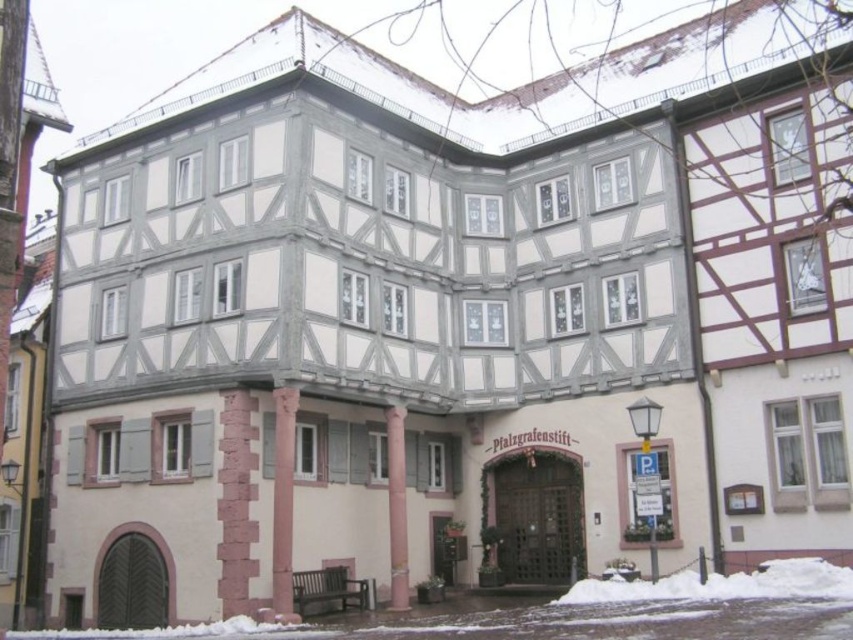
Does white powdery snow at lower left have a larger size compared to pink painted wood column at center?

Yes.

Does white powdery snow at lower left have a greater width compared to pink painted wood column at center?

Indeed, white powdery snow at lower left has a greater width compared to pink painted wood column at center.

Between point (412, 618) and point (404, 492), which one is positioned in front?

Point (412, 618)

The image size is (853, 640). Find the location of `white powdery snow at lower left`. white powdery snow at lower left is located at coordinates (596, 612).

Is white powdery snow at lower left thinner than white powdery snow at lower center?

No, white powdery snow at lower left is not thinner than white powdery snow at lower center.

How far apart are white powdery snow at lower left and white powdery snow at lower center?

A distance of 4.89 meters exists between white powdery snow at lower left and white powdery snow at lower center.

Describe the element at coordinates (596, 612) in the screenshot. I see `white powdery snow at lower left` at that location.

At what (x,y) coordinates should I click in order to perform the action: click on white powdery snow at lower left. Please return your answer as a coordinate pair (x, y). Looking at the image, I should click on 596,612.

Is white powdery snow at lower center positioned at the back of pink stone pillar at lower left?

No, it is in front of pink stone pillar at lower left.

Can you confirm if white powdery snow at lower center is smaller than pink stone pillar at lower left?

Actually, white powdery snow at lower center might be larger than pink stone pillar at lower left.

Locate an element on the screen. Image resolution: width=853 pixels, height=640 pixels. white powdery snow at lower center is located at coordinates (723, 584).